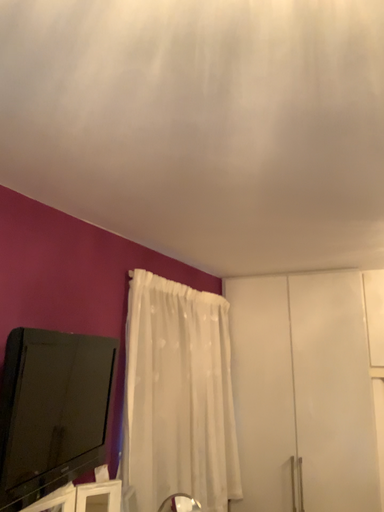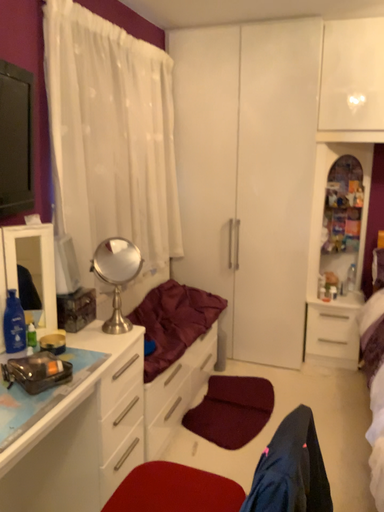
Question: Which way did the camera rotate in the video?

Choices:
 (A) rotated upward
 (B) rotated downward

Answer: (B)